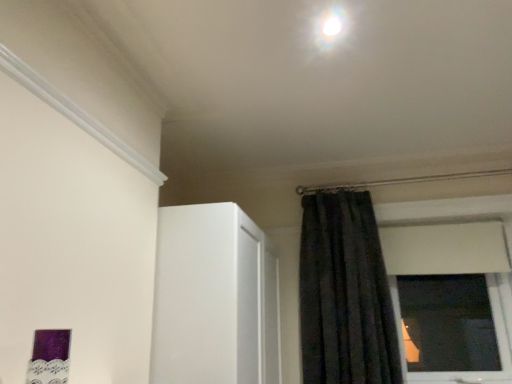
Locate an element on the screen. This screenshot has height=384, width=512. white glossy light at upper center is located at coordinates (332, 26).

What do you see at coordinates (332, 26) in the screenshot? I see `white glossy light at upper center` at bounding box center [332, 26].

Measure the distance between point (340, 22) and camera.

The distance of point (340, 22) from camera is 4.61 feet.

This screenshot has width=512, height=384. Identify the location of black velvet curtain at upper right. (344, 294).

Describe the element at coordinates (344, 294) in the screenshot. I see `black velvet curtain at upper right` at that location.

This screenshot has height=384, width=512. I want to click on white glossy light at upper center, so click(332, 26).

Is white glossy light at upper center to the right of black velvet curtain at upper right from the viewer's perspective?

No, white glossy light at upper center is not to the right of black velvet curtain at upper right.

Considering the relative positions of white glossy light at upper center and black velvet curtain at upper right in the image provided, is white glossy light at upper center behind black velvet curtain at upper right?

No, white glossy light at upper center is closer to the viewer.

Is point (337, 17) positioned in front of point (361, 218)?

Yes, it is in front of point (361, 218).

Consider the image. From the image's perspective, which object appears higher, white glossy light at upper center or black velvet curtain at upper right?

white glossy light at upper center appears higher in the image.

From a real-world perspective, is white glossy light at upper center physically below black velvet curtain at upper right?

No, from a real-world perspective, white glossy light at upper center is not under black velvet curtain at upper right.

From the picture: Can you confirm if white glossy light at upper center is thinner than black velvet curtain at upper right?

Correct, the width of white glossy light at upper center is less than that of black velvet curtain at upper right.

Who is taller, white glossy light at upper center or black velvet curtain at upper right?

Standing taller between the two is black velvet curtain at upper right.

Considering the relative sizes of white glossy light at upper center and black velvet curtain at upper right in the image provided, is white glossy light at upper center bigger than black velvet curtain at upper right?

No, white glossy light at upper center is not bigger than black velvet curtain at upper right.

Would you say black velvet curtain at upper right is part of white glossy light at upper center's contents?

No, black velvet curtain at upper right is not inside white glossy light at upper center.

Is white glossy light at upper center positioned far away from black velvet curtain at upper right?

Yes, white glossy light at upper center and black velvet curtain at upper right are quite far apart.

Is white glossy light at upper center turned away from black velvet curtain at upper right?

No, white glossy light at upper center's orientation is not away from black velvet curtain at upper right.

How distant is white glossy light at upper center from black velvet curtain at upper right?

white glossy light at upper center is 1.42 meters away from black velvet curtain at upper right.

Find the location of a particular element. This screenshot has width=512, height=384. light located in front of the black velvet curtain at upper right is located at coordinates (332, 26).

Would you say black velvet curtain at upper right is to the left or to the right of white glossy light at upper center in the picture?

From the image, it's evident that black velvet curtain at upper right is to the right of white glossy light at upper center.

Which object is closer to the camera taking this photo, black velvet curtain at upper right or white glossy light at upper center?

white glossy light at upper center.

Considering the points (306, 328) and (329, 30), which point is behind, point (306, 328) or point (329, 30)?

Positioned behind is point (306, 328).

From the image's perspective, would you say black velvet curtain at upper right is shown under white glossy light at upper center?

Yes, from the image's perspective, black velvet curtain at upper right is below white glossy light at upper center.

From a real-world perspective, between black velvet curtain at upper right and white glossy light at upper center, who is vertically lower?

From a 3D spatial view, black velvet curtain at upper right is below.

Looking at this image, is black velvet curtain at upper right thinner than white glossy light at upper center?

No.

Who is taller, black velvet curtain at upper right or white glossy light at upper center?

black velvet curtain at upper right is taller.

Considering the sizes of objects black velvet curtain at upper right and white glossy light at upper center in the image provided, who is bigger, black velvet curtain at upper right or white glossy light at upper center?

black velvet curtain at upper right.

Is black velvet curtain at upper right inside the boundaries of white glossy light at upper center, or outside?

black velvet curtain at upper right is not enclosed by white glossy light at upper center.

Is black velvet curtain at upper right next to white glossy light at upper center?

black velvet curtain at upper right and white glossy light at upper center are clearly separated.

Is black velvet curtain at upper right positioned with its back to white glossy light at upper center?

That's not correct — black velvet curtain at upper right is not looking away from white glossy light at upper center.

In the image, there is a black velvet curtain at upper right. Where is `light above it (from the image's perspective)`? This screenshot has height=384, width=512. light above it (from the image's perspective) is located at coordinates (332, 26).

In the image, there is a white glossy light at upper center. Where is `curtain below it (from the image's perspective)`? The image size is (512, 384). curtain below it (from the image's perspective) is located at coordinates (344, 294).

Image resolution: width=512 pixels, height=384 pixels. I want to click on light located on the left of black velvet curtain at upper right, so click(332, 26).